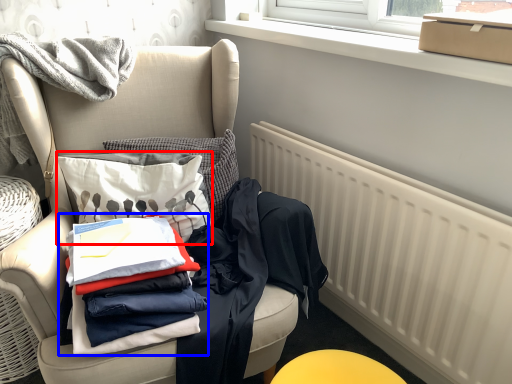
Question: Which object appears farthest to the camera in this image, throw pillow (highlighted by a red box) or clothing (highlighted by a blue box)?

Choices:
 (A) throw pillow
 (B) clothing

Answer: (A)